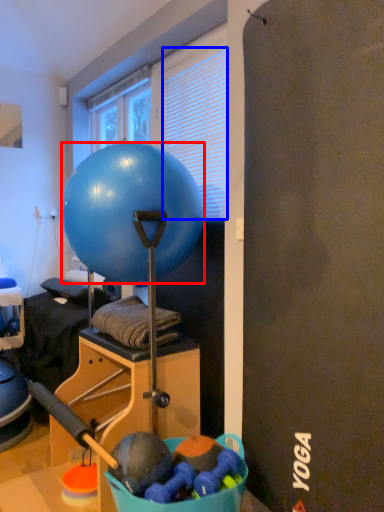
Question: Which object is closer to the camera taking this photo, ball (highlighted by a red box) or blind (highlighted by a blue box)?

Choices:
 (A) ball
 (B) blind

Answer: (A)